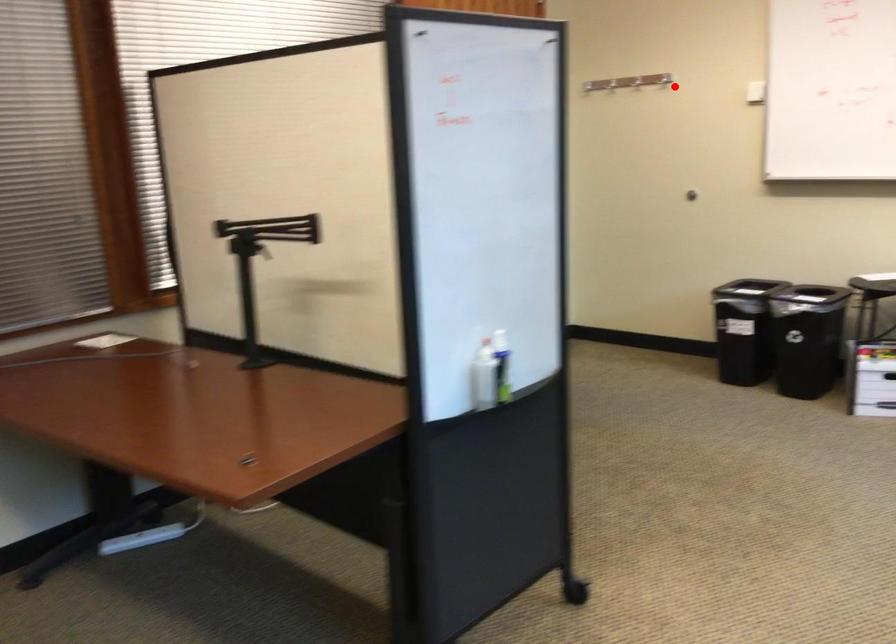
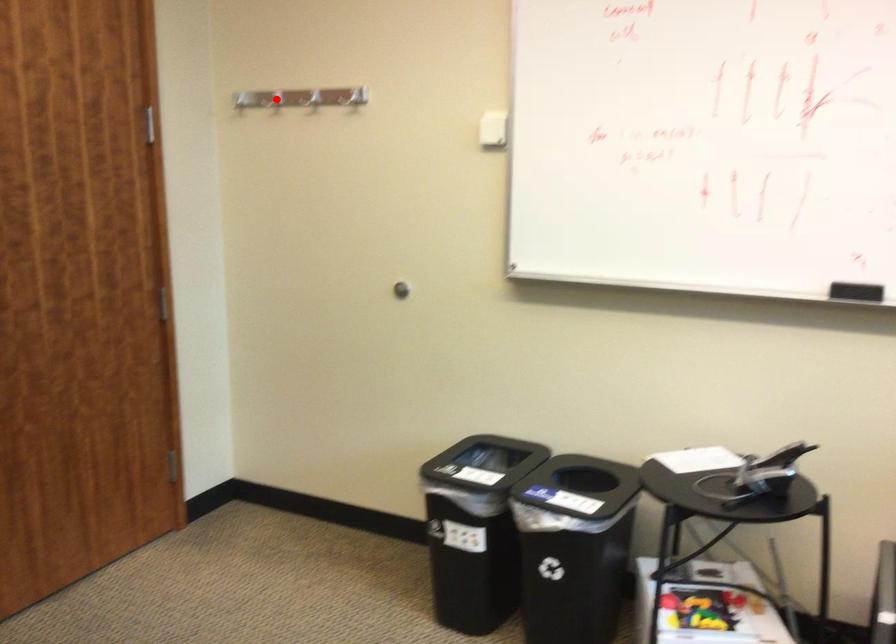
I am providing you with two images of the same scene from different viewpoints. A red point is marked on the first image and another point is marked on the second image. Is the marked point in image1 the same physical position as the marked point in image2?

No